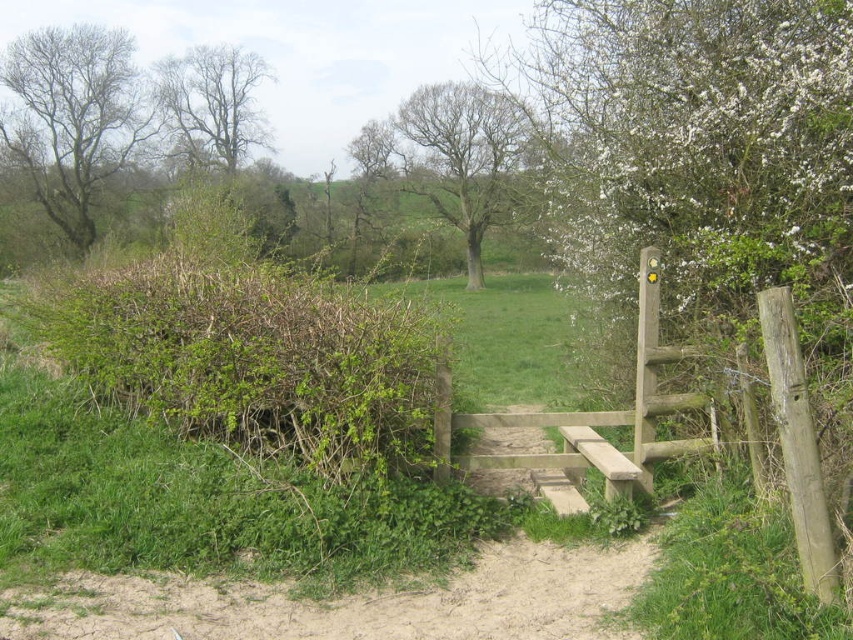
Does point (480, 138) come behind point (251, 148)?

No, (480, 138) is in front of (251, 148).

Is bare brown tree at center behind bare branches tree at upper left?

No, bare brown tree at center is in front of bare branches tree at upper left.

What are the coordinates of `bare brown tree at center` in the screenshot? It's located at (463, 160).

Can you confirm if green leafy hedge at left is wider than bare branches tree at upper left?

Yes.

This screenshot has height=640, width=853. I want to click on green leafy hedge at left, so click(254, 349).

Which is in front, point (236, 227) or point (221, 163)?

Point (236, 227) is more forward.

Where is `green leafy hedge at left`? The height and width of the screenshot is (640, 853). green leafy hedge at left is located at coordinates (254, 349).

Can you confirm if green leafy hedge at left is thinner than bare branches at left?

No, green leafy hedge at left is not thinner than bare branches at left.

Which is behind, point (276, 413) or point (83, 154)?

The point (83, 154) is behind.

The height and width of the screenshot is (640, 853). Identify the location of green leafy hedge at left. (254, 349).